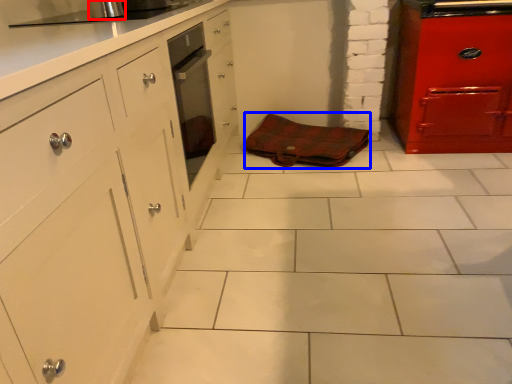
Question: Among these objects, which one is farthest to the camera, appliance (highlighted by a red box) or material (highlighted by a blue box)?

Choices:
 (A) appliance
 (B) material

Answer: (B)